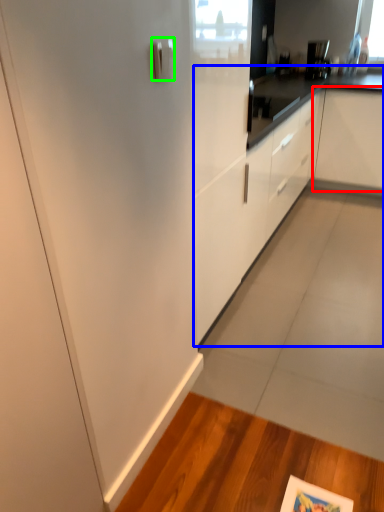
Question: Considering the real-world distances, which object is closest to cabinetry (highlighted by a red box)? cabinetry (highlighted by a blue box) or door handle (highlighted by a green box).

Choices:
 (A) cabinetry
 (B) door handle

Answer: (A)